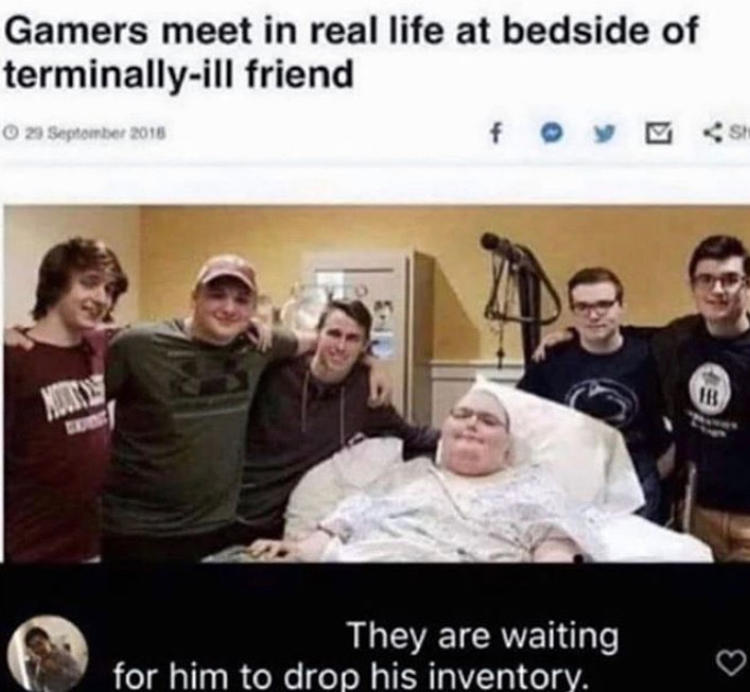
At what (x,y) coordinates should I click in order to perform the action: click on wall. Please return your answer as a coordinate pair (x, y). This screenshot has height=692, width=750. Looking at the image, I should click on (622, 254).